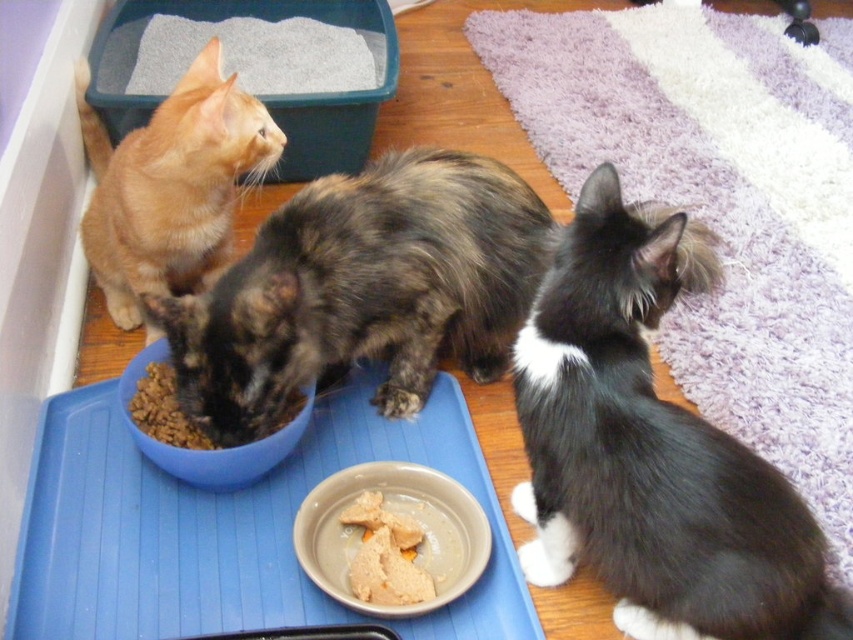
Between fluffy tortoiseshell cat at center and blue plastic bowl at center, which one has more height?

fluffy tortoiseshell cat at center

Who is more distant from viewer, (390, 332) or (126, 401)?

The point (390, 332) is more distant.

Measure the distance between point (x=190, y=314) and camera.

Point (x=190, y=314) is 3.82 feet away from camera.

Identify the location of fluffy tortoiseshell cat at center. This screenshot has width=853, height=640. (363, 291).

Is fluffy tortoiseshell cat at center above matte gray bowl at lower center?

Correct, fluffy tortoiseshell cat at center is located above matte gray bowl at lower center.

Is point (383, 262) behind point (430, 470)?

Yes, it is.

The width and height of the screenshot is (853, 640). Find the location of `fluffy tortoiseshell cat at center`. fluffy tortoiseshell cat at center is located at coordinates (363, 291).

Is black and white fur cat at right above fluffy tortoiseshell cat at center?

Incorrect, black and white fur cat at right is not positioned above fluffy tortoiseshell cat at center.

Does black and white fur cat at right have a lesser width compared to fluffy tortoiseshell cat at center?

Yes.

Is point (606, 369) positioned in front of point (373, 237)?

Yes.

Locate an element on the screen. black and white fur cat at right is located at coordinates (651, 449).